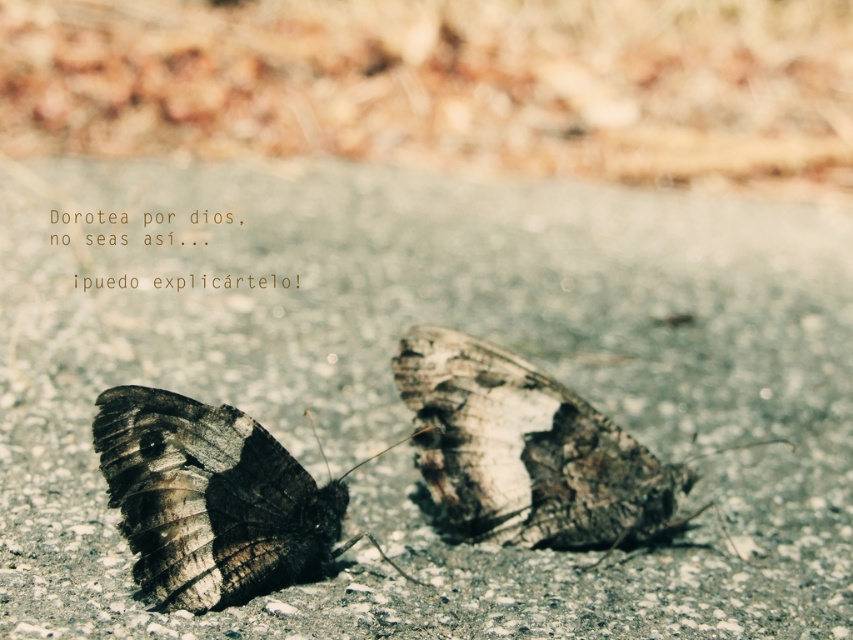
Question: Which object appears closest to the camera in this image?

Choices:
 (A) dark brown textured butterfly at lower left
 (B) brown textured butterfly at center

Answer: (A)

Question: Does brown textured butterfly at center lie in front of dark brown textured butterfly at lower left?

Choices:
 (A) yes
 (B) no

Answer: (B)

Question: Which object appears closest to the camera in this image?

Choices:
 (A) dark brown textured butterfly at lower left
 (B) brown textured butterfly at center

Answer: (A)

Question: Is brown textured butterfly at center below dark brown textured butterfly at lower left?

Choices:
 (A) no
 (B) yes

Answer: (A)

Question: Is brown textured butterfly at center to the right of dark brown textured butterfly at lower left from the viewer's perspective?

Choices:
 (A) yes
 (B) no

Answer: (A)